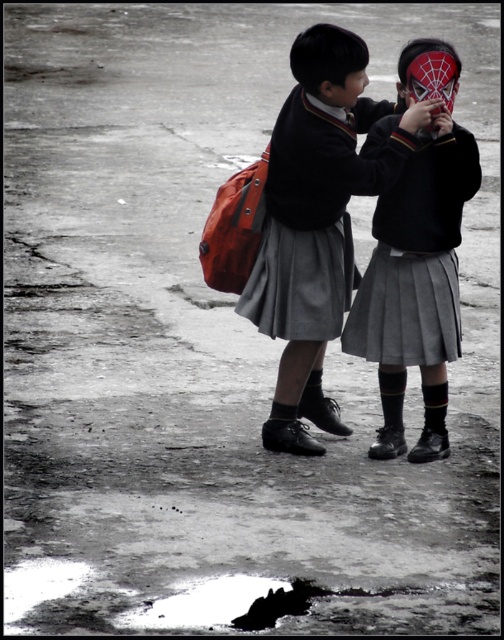
Who is higher up, matte black school uniform at center or matte gray skirt at center?

matte black school uniform at center is above.

The width and height of the screenshot is (504, 640). I want to click on matte black school uniform at center, so click(311, 227).